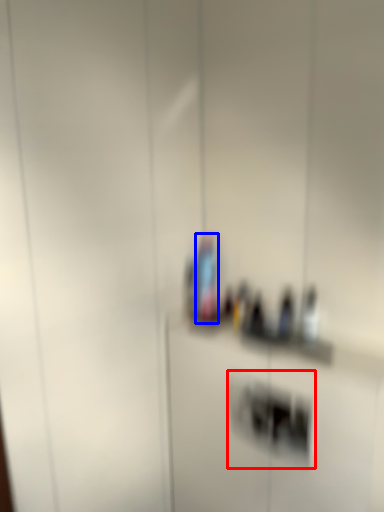
Question: Which object appears closest to the camera in this image, light switch (highlighted by a red box) or bottle (highlighted by a blue box)?

Choices:
 (A) light switch
 (B) bottle

Answer: (A)